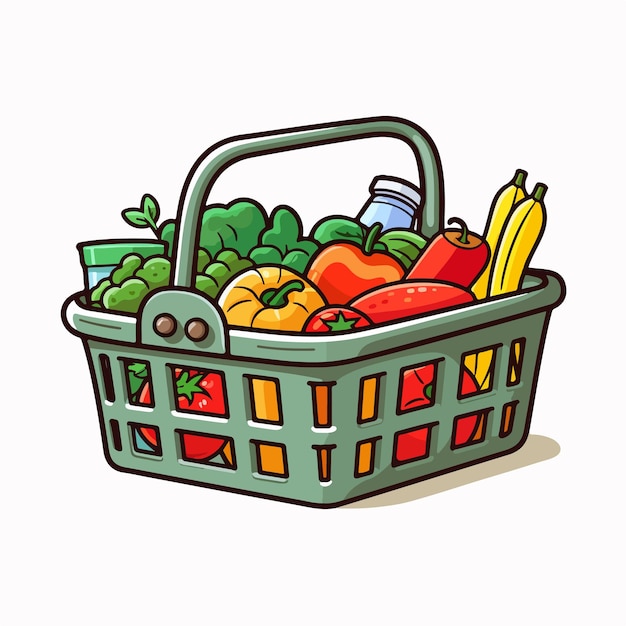
The image size is (626, 626). Find the location of `handle`. handle is located at coordinates (270, 140).